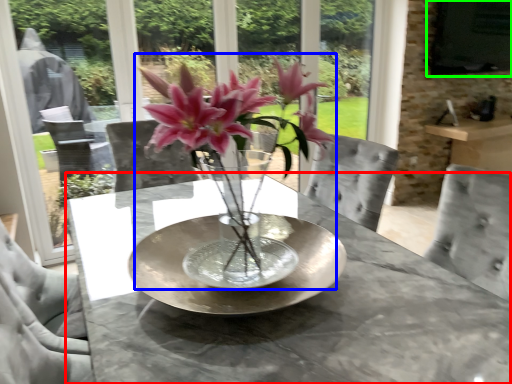
Question: Which is nearer to the table (highlighted by a red box)? houseplant (highlighted by a blue box) or window screen (highlighted by a green box).

Choices:
 (A) houseplant
 (B) window screen

Answer: (A)